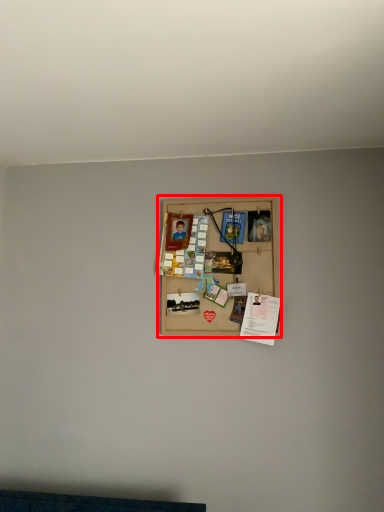
Question: Considering the relative positions of picture frame (annotated by the red box) and writing in the image provided, where is picture frame (annotated by the red box) located with respect to the staircase?

Choices:
 (A) right
 (B) left

Answer: (B)